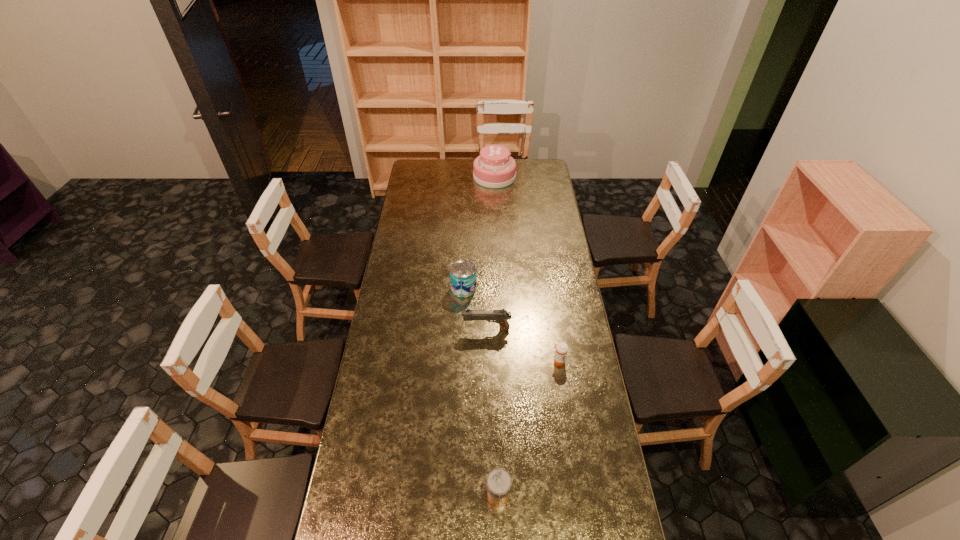
In the image, there is a desktop. Where is `vacant area at the left edge`? The width and height of the screenshot is (960, 540). vacant area at the left edge is located at coordinates (403, 392).

The height and width of the screenshot is (540, 960). Find the location of `free space at the right edge of the desktop`. free space at the right edge of the desktop is located at coordinates (577, 313).

This screenshot has width=960, height=540. I want to click on free space at the far left corner of the desktop, so click(417, 163).

This screenshot has width=960, height=540. What are the coordinates of `unoccupied area between the can and the farther medicine` in the screenshot? It's located at (511, 325).

The image size is (960, 540). Identify the location of empty location between the farthest object and the can. (479, 232).

I want to click on free space between the nearer medicine and the fourth farthest object, so (x=528, y=428).

Where is `vacant region between the gun and the rightmost object`? This screenshot has width=960, height=540. vacant region between the gun and the rightmost object is located at coordinates (522, 345).

You are a GUI agent. You are given a task and a screenshot of the screen. Output one action in this format:
    pyautogui.click(x=<x>, y=<y>)
    Task: Click on the vacant space that's between the rightmost object and the tallest object
    
    Given the screenshot: What is the action you would take?
    pyautogui.click(x=526, y=269)

At what (x,y) coordinates should I click in order to perform the action: click on free space that is in between the fourth nearest object and the nearest object. Please return your answer as a coordinate pair (x, y). This screenshot has height=540, width=960. Looking at the image, I should click on (481, 392).

At what (x,y) coordinates should I click in order to perform the action: click on object that is the closest to the nearest object. Please return your answer as a coordinate pair (x, y). This screenshot has height=540, width=960. Looking at the image, I should click on (561, 348).